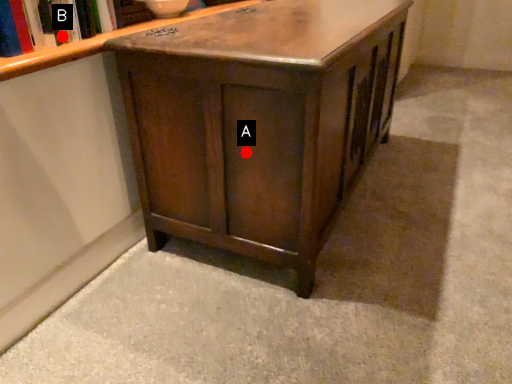
Question: Two points are circled on the image, labeled by A and B beside each circle. Which point is farther from the camera taking this photo?

Choices:
 (A) A is further
 (B) B is further

Answer: (A)